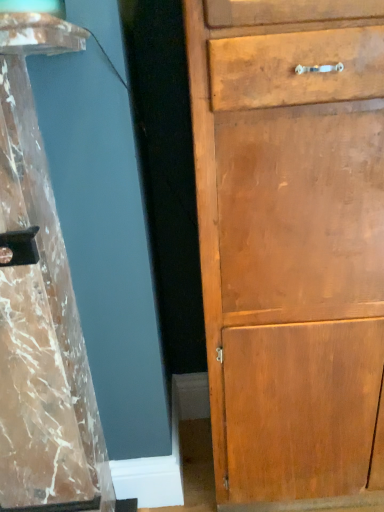
Question: Would you say wooden cabinet at right is inside or outside marble-like wood at left?

Choices:
 (A) outside
 (B) inside

Answer: (A)

Question: From their relative heights in the image, would you say wooden cabinet at right is taller or shorter than marble-like wood at left?

Choices:
 (A) tall
 (B) short

Answer: (A)

Question: Is point (342, 198) positioned closer to the camera than point (54, 280)?

Choices:
 (A) farther
 (B) closer

Answer: (B)

Question: In the image, is marble-like wood at left on the left side or the right side of wooden cabinet at right?

Choices:
 (A) left
 (B) right

Answer: (A)

Question: From the image's perspective, relative to wooden cabinet at right, is marble-like wood at left above or below?

Choices:
 (A) above
 (B) below

Answer: (B)

Question: In the image, is marble-like wood at left positioned in front of or behind wooden cabinet at right?

Choices:
 (A) front
 (B) behind

Answer: (A)

Question: Is marble-like wood at left situated inside wooden cabinet at right or outside?

Choices:
 (A) inside
 (B) outside

Answer: (B)